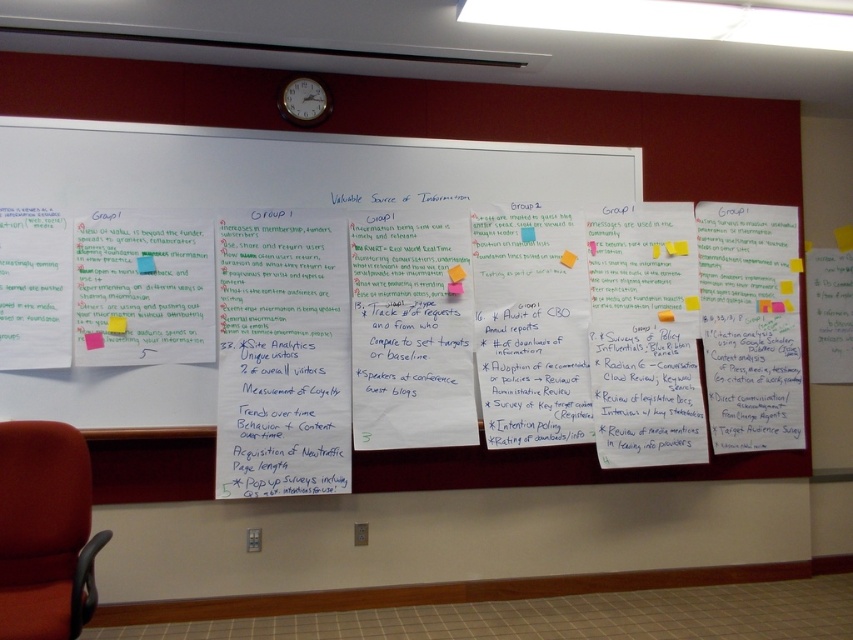
Question: Does yellow sticky note at center lie behind orange sticky note at center-right?

Choices:
 (A) no
 (B) yes

Answer: (A)

Question: Is red fabric chair at lower left bigger than pink sticky note at lower left?

Choices:
 (A) no
 (B) yes

Answer: (B)

Question: Observing the image, what is the correct spatial positioning of metallic silver clock at upper center in reference to matte blue sticky note at left?

Choices:
 (A) right
 (B) left

Answer: (A)

Question: Which object appears closest to the camera in this image?

Choices:
 (A) metallic silver clock at upper center
 (B) red fabric chair at lower left

Answer: (B)

Question: Which of the following is the farthest from the observer?

Choices:
 (A) (140, 257)
 (B) (97, 344)
 (C) (572, 266)

Answer: (C)

Question: Considering the real-world distances, which object is closest to the matte blue sticky note at left?

Choices:
 (A) red fabric chair at lower left
 (B) yellow sticky note at lower left
 (C) yellow sticky note at center
 (D) metallic silver clock at upper center

Answer: (B)